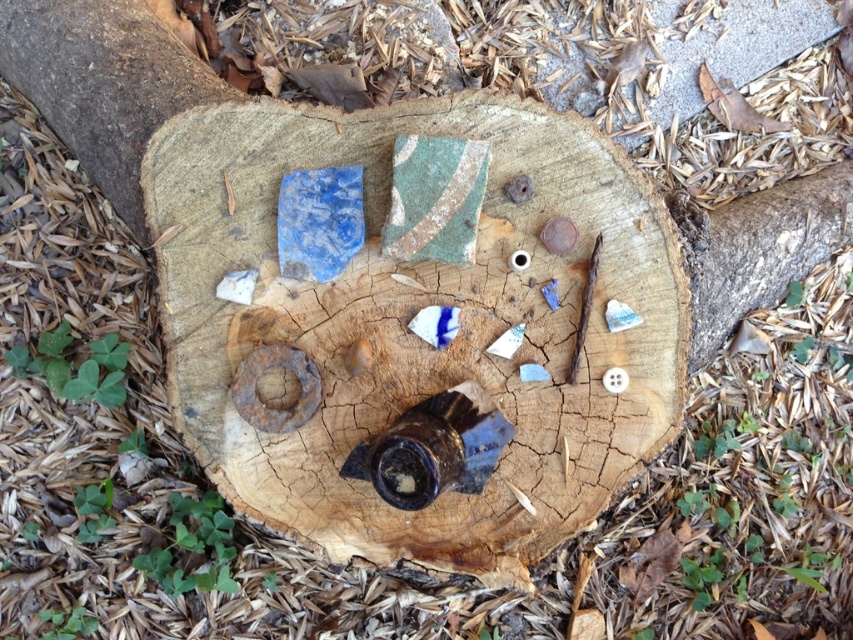
Question: Which point appears closest to the camera in this image?

Choices:
 (A) (669, 442)
 (B) (33, 102)

Answer: (A)

Question: Can you confirm if blue ceramic tile at center is positioned to the right of brown rough wood at upper left?

Choices:
 (A) yes
 (B) no

Answer: (A)

Question: Which of the following is the closest to the observer?

Choices:
 (A) (97, 140)
 (B) (372, 214)

Answer: (B)

Question: Is blue ceramic tile at center thinner than brown rough wood at upper left?

Choices:
 (A) no
 (B) yes

Answer: (A)

Question: Considering the relative positions of blue ceramic tile at center and brown rough wood at upper left in the image provided, where is blue ceramic tile at center located with respect to brown rough wood at upper left?

Choices:
 (A) above
 (B) below

Answer: (B)

Question: Which object is farther from the camera taking this photo?

Choices:
 (A) brown rough wood at upper left
 (B) blue ceramic tile at center

Answer: (A)